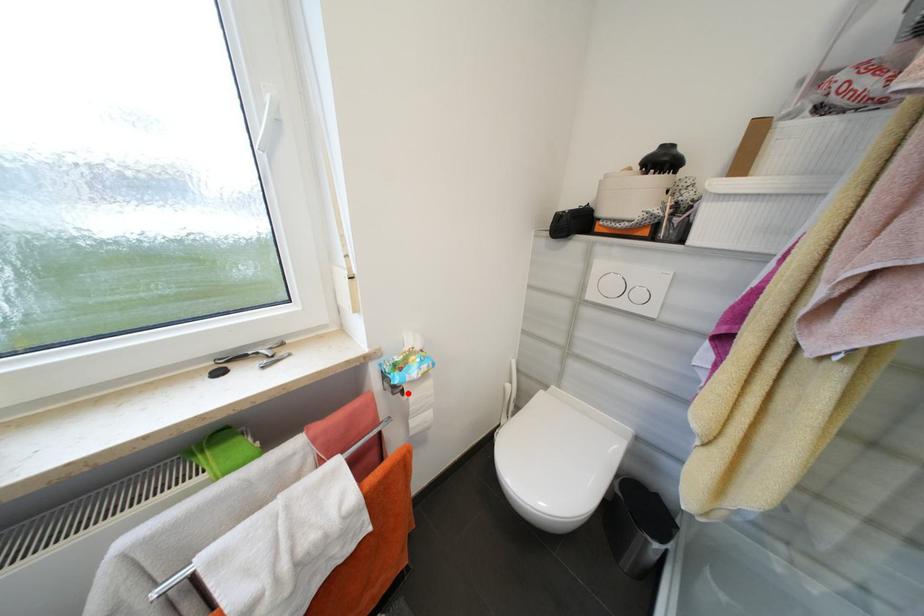
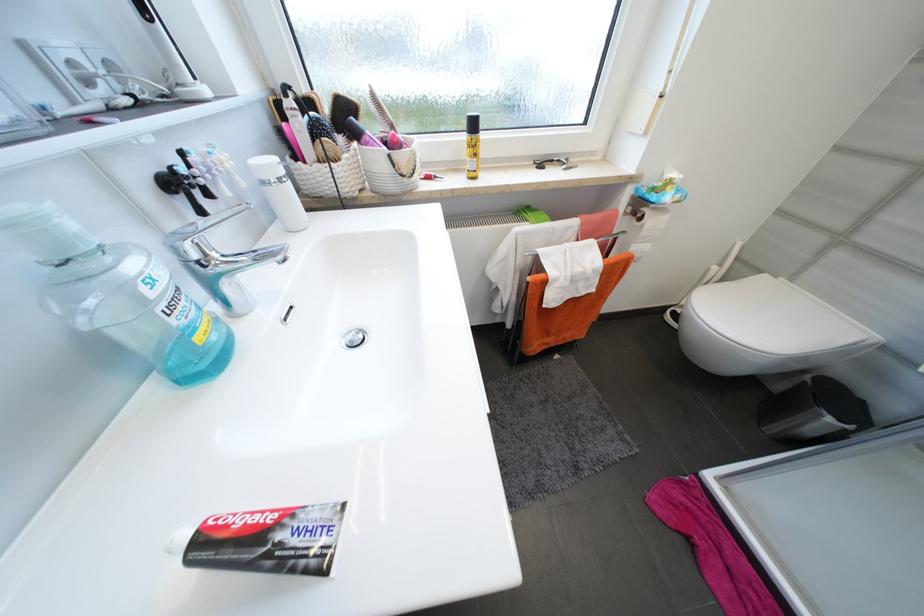
Question: A red point is marked in image1. In image2, is the corresponding 3D point closer to the camera or farther? Reply with the corresponding letter.

Choices:
 (A) The corresponding 3D point is closer.
 (B) The corresponding 3D point is farther.

Answer: (A)